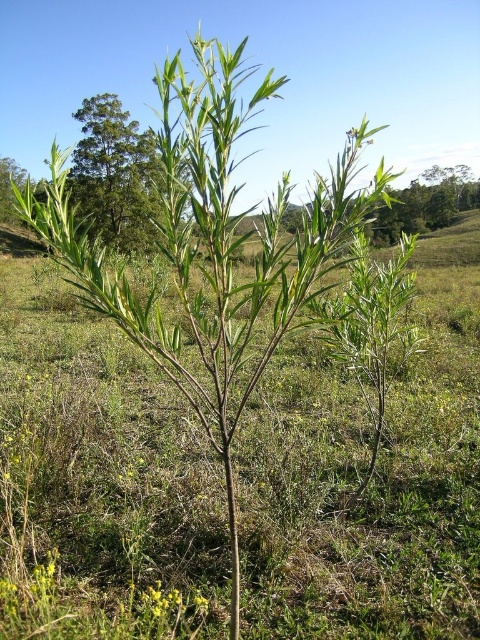
Based on the coordinates provided, where is the green leafy tree at upper left located in the image?

The green leafy tree at upper left is located at the coordinates point (113, 173) in the image.

You are an artist sketching the scene. You need to decide which object to draw first based on their sizes. Which one should you start with, the green leafy tree at upper left or the yellow matte flower at lower center?

The green leafy tree at upper left is larger in size than the yellow matte flower at lower center, so you should start by drawing the green leafy tree at upper left first because it is bigger and will form the main structure of the sketch.